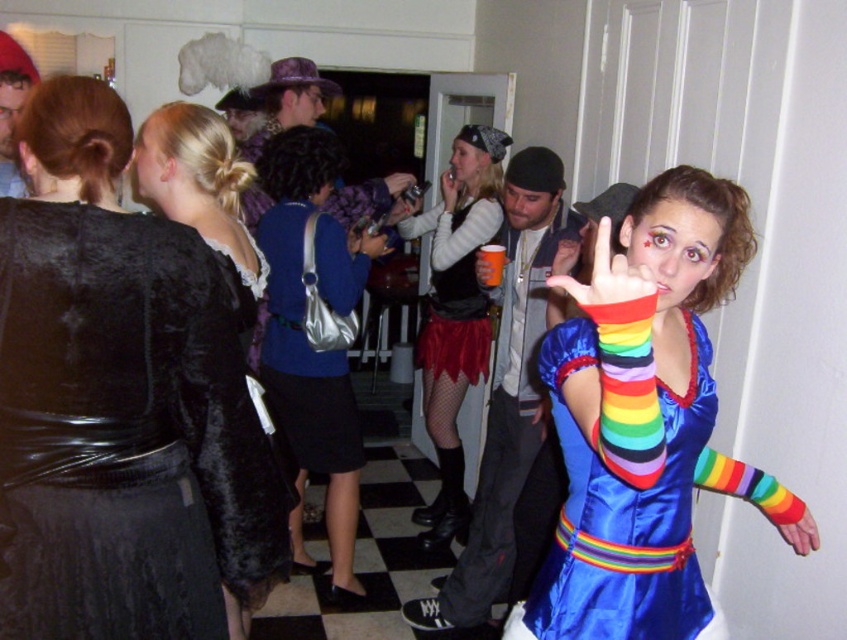
Which is behind, point (37, 385) or point (457, 515)?

The point (457, 515) is behind.

Does velvet black dress at upper left lie behind velvet red skirt at center?

That is False.

Is point (126, 324) closer to viewer compared to point (436, 225)?

Yes.

You are a GUI agent. You are given a task and a screenshot of the screen. Output one action in this format:
    pyautogui.click(x=<x>, y=<y>)
    Task: Click on the velvet black dress at upper left
    
    Given the screenshot: What is the action you would take?
    pyautogui.click(x=120, y=403)

Measure the distance between shiny silver purse at center and camera.

The distance of shiny silver purse at center from camera is 9.09 feet.

The height and width of the screenshot is (640, 847). I want to click on shiny silver purse at center, so click(306, 339).

Who is shorter, rainbow satin dress at center or shiny silver purse at center?

With less height is rainbow satin dress at center.

Is rainbow satin dress at center above shiny silver purse at center?

No.

Is point (673, 508) positioned in front of point (342, 259)?

Yes, it is.

You are a GUI agent. You are given a task and a screenshot of the screen. Output one action in this format:
    pyautogui.click(x=<x>, y=<y>)
    Task: Click on the rainbow satin dress at center
    
    Given the screenshot: What is the action you would take?
    pyautogui.click(x=634, y=484)